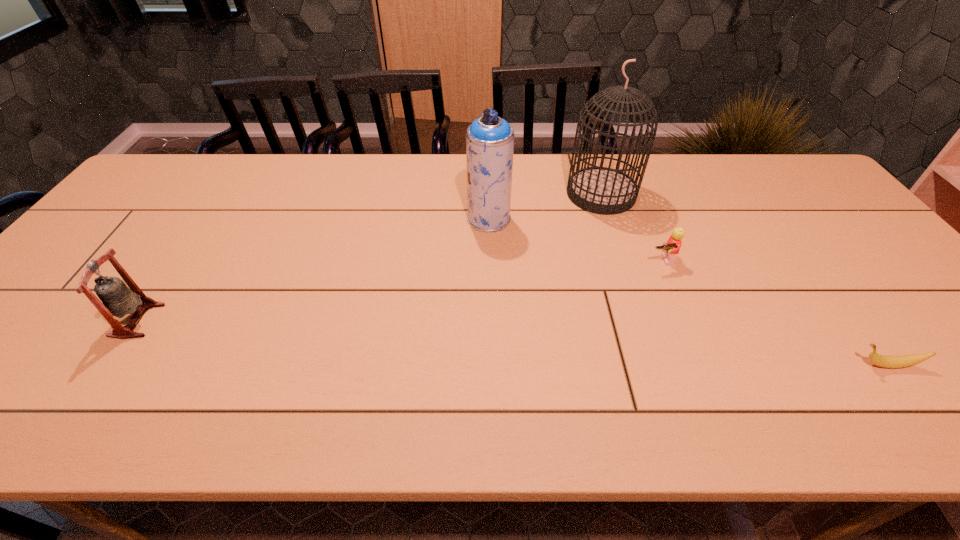
Locate an element on the screen. the tallest object is located at coordinates (600, 190).

Locate an element on the screen. aerosol can is located at coordinates (489, 139).

Where is `the fourth shortest object`? The width and height of the screenshot is (960, 540). the fourth shortest object is located at coordinates (489, 139).

Locate an element on the screen. This screenshot has width=960, height=540. the leftmost object is located at coordinates (117, 299).

Where is `the fourth farthest object`? The image size is (960, 540). the fourth farthest object is located at coordinates (117, 299).

You are a GUI agent. You are given a task and a screenshot of the screen. Output one action in this format:
    pyautogui.click(x=<x>, y=<y>)
    Task: Click on the third farthest object
    Image resolution: width=960 pixels, height=540 pixels.
    Given the screenshot: What is the action you would take?
    pyautogui.click(x=672, y=247)

What are the coordinates of `the fourth tallest object` in the screenshot? It's located at (672, 247).

Locate an element on the screen. This screenshot has width=960, height=540. the rightmost object is located at coordinates (887, 361).

The height and width of the screenshot is (540, 960). In order to click on the shortest object in this screenshot , I will do `click(887, 361)`.

This screenshot has width=960, height=540. Identify the location of free space located 0.290m on the front of the birdcage. (632, 288).